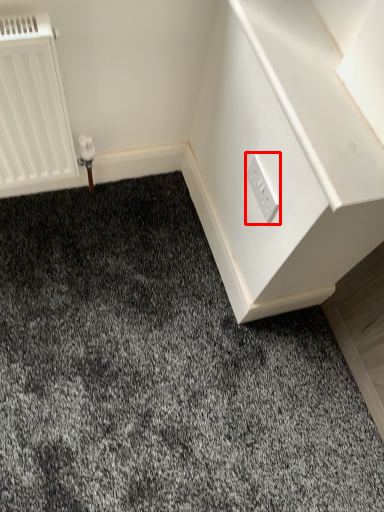
Question: Observing the image, what is the correct spatial positioning of power plugs and sockets (annotated by the red box) in reference to dresser?

Choices:
 (A) left
 (B) right

Answer: (A)